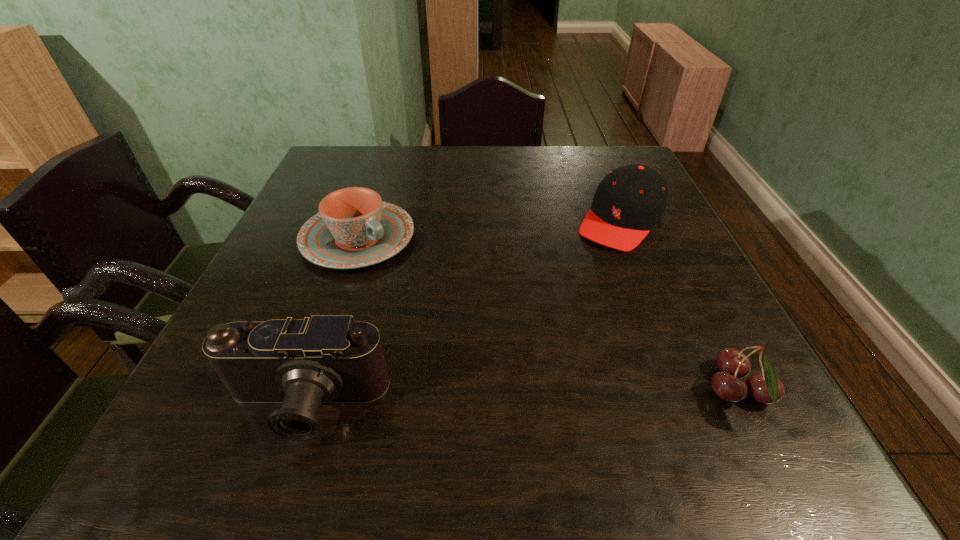
Find the location of a particular element. The width and height of the screenshot is (960, 540). camera is located at coordinates (301, 363).

In order to click on cherry in this screenshot , I will do `click(766, 388)`.

Where is `cap`? Image resolution: width=960 pixels, height=540 pixels. cap is located at coordinates (631, 200).

This screenshot has width=960, height=540. What are the coordinates of `chinaware` in the screenshot? It's located at (354, 228).

The width and height of the screenshot is (960, 540). In order to click on vacant space located on the front-facing side of the cap in this screenshot , I will do `click(512, 357)`.

In order to click on vacant space located 0.120m on the front-facing side of the cap in this screenshot , I will do `click(580, 274)`.

Find the location of a particular element. The width and height of the screenshot is (960, 540). vacant region located 0.110m on the front-facing side of the cap is located at coordinates (582, 272).

The width and height of the screenshot is (960, 540). In order to click on free space located on the handle side of the chinaware in this screenshot , I will do `click(424, 285)`.

Locate an element on the screen. vacant position located on the handle side of the chinaware is located at coordinates (489, 329).

You are a GUI agent. You are given a task and a screenshot of the screen. Output one action in this format:
    pyautogui.click(x=<x>, y=<y>)
    Task: Click on the vacant space located on the handle side of the chinaware
    This screenshot has height=540, width=960.
    Given the screenshot: What is the action you would take?
    pyautogui.click(x=522, y=352)